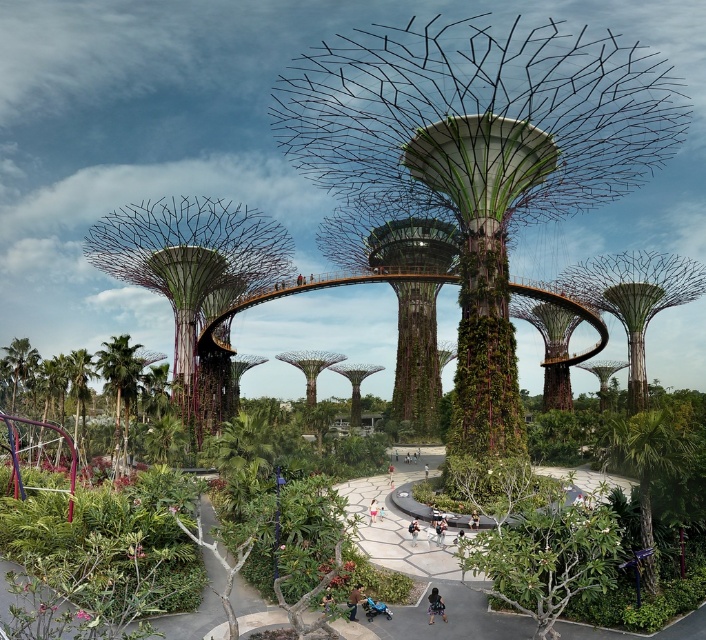
You are standing at the camera position in the Gardens by the Bay and want to reach the point labeled as point (430, 612). If you walk directly towards it, how far will you have to walk?

You will have to walk 26.05 meters to reach point (430, 612) from the camera position.

You are a fashion designer observing a person in the garden. You notice the light blue denim shorts at lower center and the brown leather jacket at lower center. Which clothing item appears taller in the image?

The light blue denim shorts at lower center appears taller than the brown leather jacket at lower center in the image.